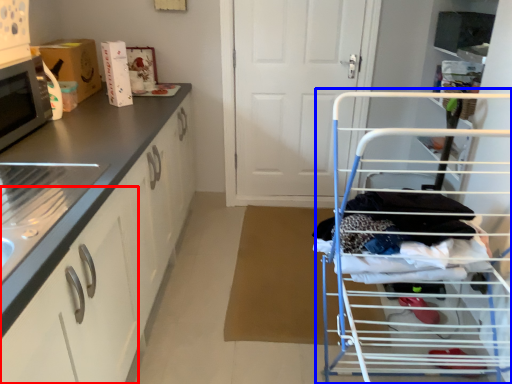
Question: Which object is closer to the camera taking this photo, drawer (highlighted by a red box) or baby carriage (highlighted by a blue box)?

Choices:
 (A) drawer
 (B) baby carriage

Answer: (B)